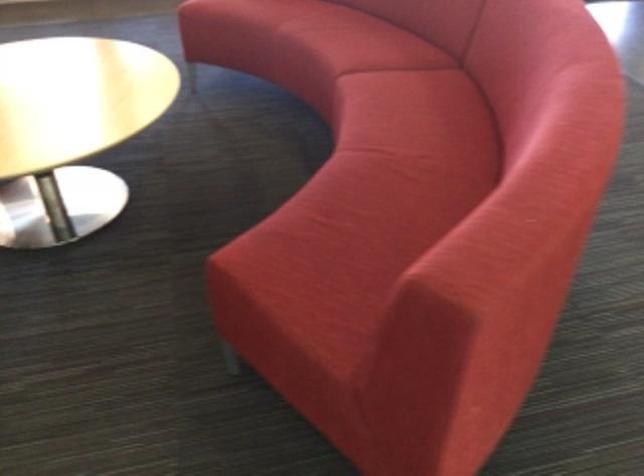
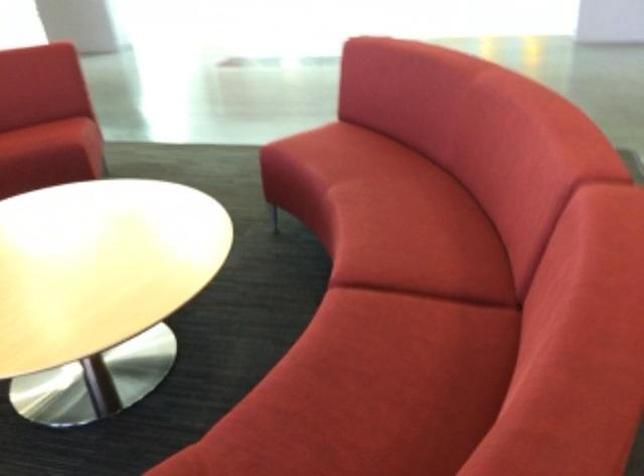
Where in the second image is the point corresponding to point (310, 235) from the first image?

(46, 136)